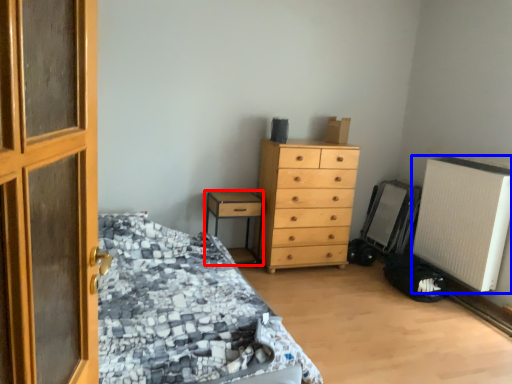
Question: Among these objects, which one is nearest to the camera, nightstand (highlighted by a red box) or air conditioning (highlighted by a blue box)?

Choices:
 (A) nightstand
 (B) air conditioning

Answer: (B)